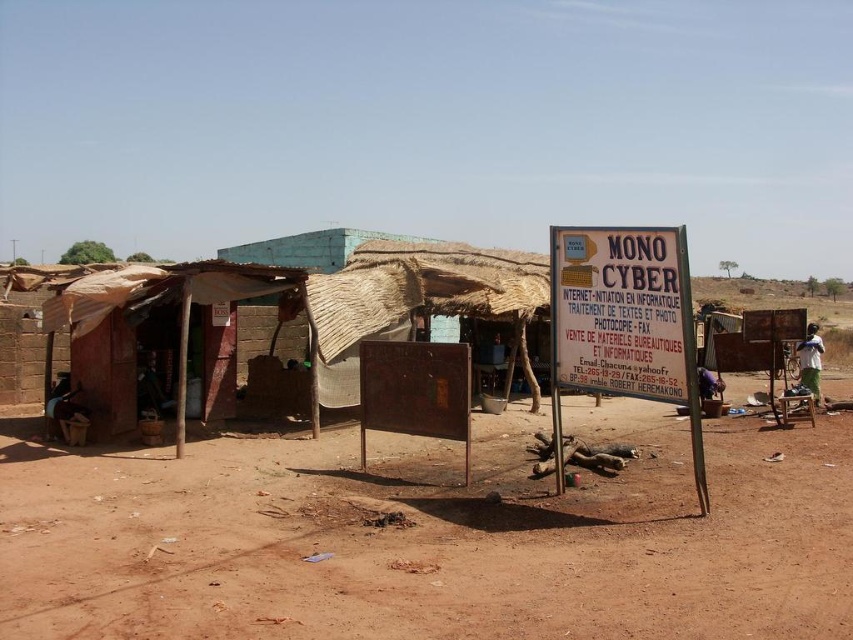
Question: Which object is closer to the camera taking this photo?

Choices:
 (A) white fabric shirt at right
 (B) brown dirt field at center
 (C) white paper sign at center

Answer: (B)

Question: Can you confirm if brown dirt field at center is bigger than white paper sign at center?

Choices:
 (A) no
 (B) yes

Answer: (B)

Question: Is white paper sign at center above white fabric shirt at right?

Choices:
 (A) no
 (B) yes

Answer: (B)

Question: Is white paper sign at center smaller than white fabric shirt at right?

Choices:
 (A) no
 (B) yes

Answer: (A)

Question: Which object is closer to the camera taking this photo?

Choices:
 (A) brown dirt field at center
 (B) white paper sign at center
 (C) white fabric shirt at right

Answer: (A)

Question: Among these objects, which one is farthest from the camera?

Choices:
 (A) brown dirt field at center
 (B) white paper sign at center
 (C) white fabric shirt at right

Answer: (C)